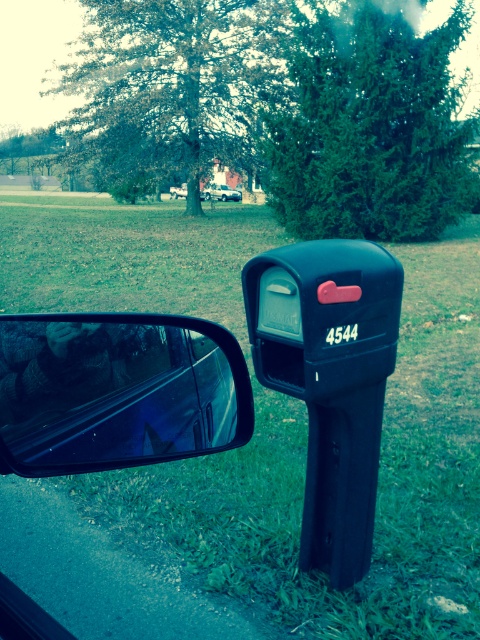
Which is above, shiny black mirror at lower left or metallic silver van at center?

metallic silver van at center is above.

Is point (136, 408) farther from camera compared to point (205, 198)?

No, (136, 408) is closer to viewer.

The height and width of the screenshot is (640, 480). What are the coordinates of `shiny black mirror at lower left` in the screenshot? It's located at (117, 392).

From the picture: Does shiny black mirror at lower left come behind satin silver sedan at center?

No, shiny black mirror at lower left is closer to the viewer.

Can you confirm if shiny black mirror at lower left is thinner than satin silver sedan at center?

Yes.

Locate an element on the screen. This screenshot has width=480, height=640. shiny black mirror at lower left is located at coordinates (117, 392).

Is green grass at lower center to the right of metallic silver van at center from the viewer's perspective?

Indeed, green grass at lower center is positioned on the right side of metallic silver van at center.

Based on the photo, who is more distant from viewer, (259,456) or (199,193)?

Point (199,193)

The width and height of the screenshot is (480, 640). What do you see at coordinates (277, 417) in the screenshot? I see `green grass at lower center` at bounding box center [277, 417].

At what (x,y) coordinates should I click in order to perform the action: click on green grass at lower center. Please return your answer as a coordinate pair (x, y). Looking at the image, I should click on (277, 417).